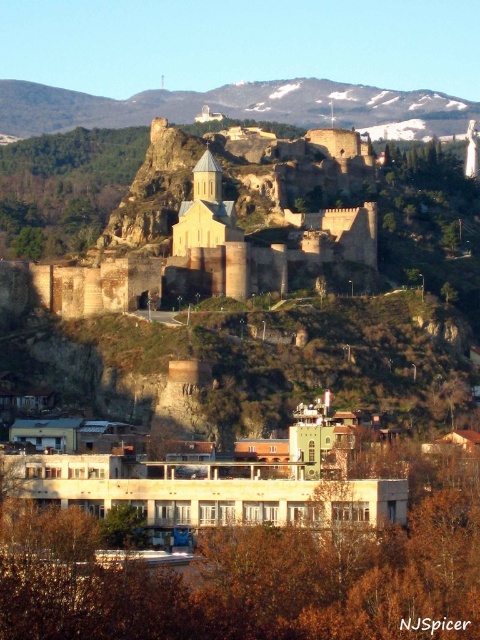
Question: Does brown stone castle at upper center lie behind snowy rocky mountain at upper center?

Choices:
 (A) yes
 (B) no

Answer: (B)

Question: Can you confirm if brown stone castle at upper center is thinner than snowy rocky mountain at upper center?

Choices:
 (A) no
 (B) yes

Answer: (B)

Question: Which point is closer to the camera?

Choices:
 (A) (201, 184)
 (B) (251, 115)

Answer: (A)

Question: Is brown stone castle at upper center smaller than snowy rocky mountain at upper center?

Choices:
 (A) yes
 (B) no

Answer: (B)